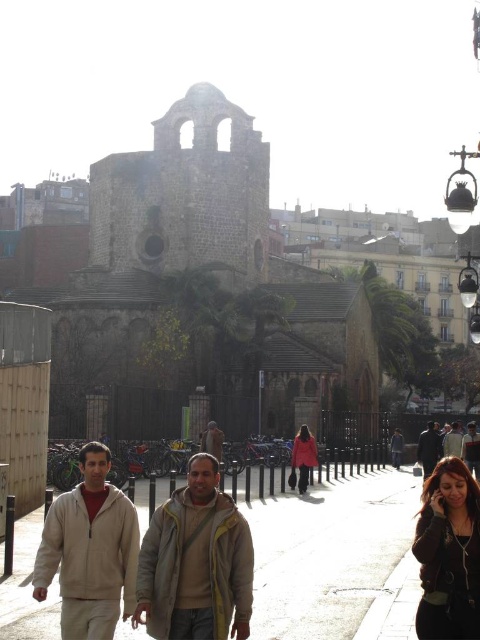
Can you confirm if matte pink coat at center is positioned to the left of dark brown leather jacket at lower right?

Yes, matte pink coat at center is to the left of dark brown leather jacket at lower right.

Describe the element at coordinates (302, 458) in the screenshot. I see `matte pink coat at center` at that location.

Does point (307, 428) come closer to viewer compared to point (430, 451)?

Yes, it is in front of point (430, 451).

The width and height of the screenshot is (480, 640). What are the coordinates of `matte pink coat at center` in the screenshot? It's located at click(302, 458).

How distant is smooth concrete pavement at lower center from matte black coat at center?

85.23 feet

Can you confirm if smooth concrete pavement at lower center is bigger than matte black coat at center?

Indeed, smooth concrete pavement at lower center has a larger size compared to matte black coat at center.

Who is more forward, [283,595] or [402,442]?

Point [283,595] is more forward.

You are a GUI agent. You are given a task and a screenshot of the screen. Output one action in this format:
    pyautogui.click(x=<x>, y=<y>)
    Task: Click on the smooth concrete pavement at lower center
    
    Given the screenshot: What is the action you would take?
    pyautogui.click(x=327, y=552)

Which is behind, point (70, 588) or point (207, 429)?

Point (207, 429)

Which is behind, point (108, 588) or point (220, 451)?

Positioned behind is point (220, 451).

Identify the location of light beige fleece jacket at lower left. (90, 550).